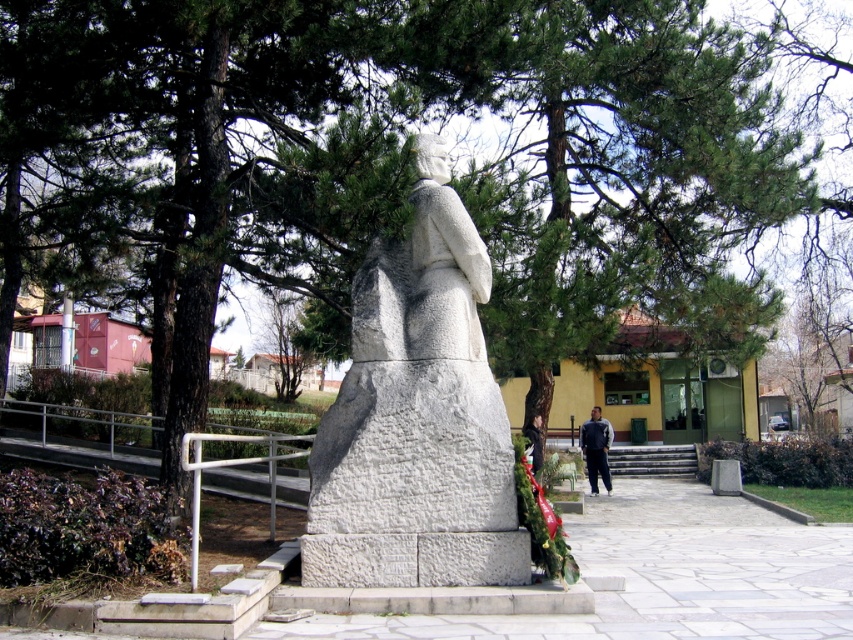
You are a photographer planning to take a photo of the white stone statue at center and the dark gray fabric pants at lower center. Which object should you focus on first if you want to ensure both are in sharp focus, considering their sizes?

The white stone statue at center is bigger than dark gray fabric pants at lower center, so you should focus on the white stone statue at center first to ensure both are in sharp focus.

You are standing in the park and want to walk from the statue to the point marked as point (595, 481). Which direction should you turn to face the point marked as point (416, 161) first before proceeding?

First, turn left to face point (416, 161) since it is closer to you than point (595, 481). After reaching point (416, 161), continue moving forward to reach point (595, 481).

Looking at this image, you are standing in the park and want to take a photo of the white stone statue at center and the dark gray fabric pants at lower center. If you face the statue, which direction should you move to include both in your photo?

Since the white stone statue at center is to the left of the dark gray fabric pants at lower center, you should move to your right to include both in your photo.